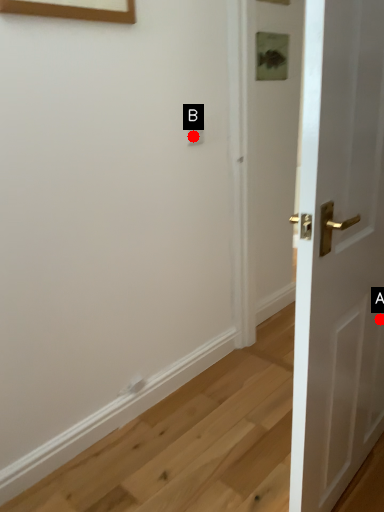
Question: Two points are circled on the image, labeled by A and B beside each circle. Which point is closer to the camera?

Choices:
 (A) A is closer
 (B) B is closer

Answer: (A)